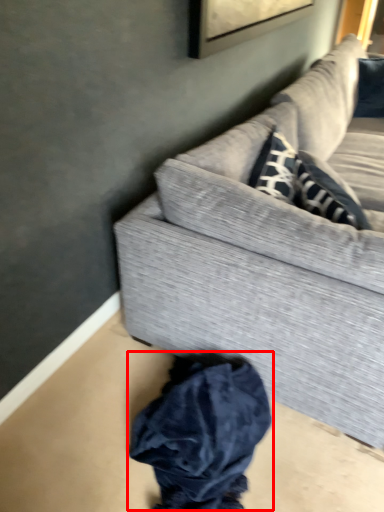
Question: Observing the image, what is the correct spatial positioning of clothing (annotated by the red box) in reference to studio couch?

Choices:
 (A) right
 (B) left

Answer: (B)